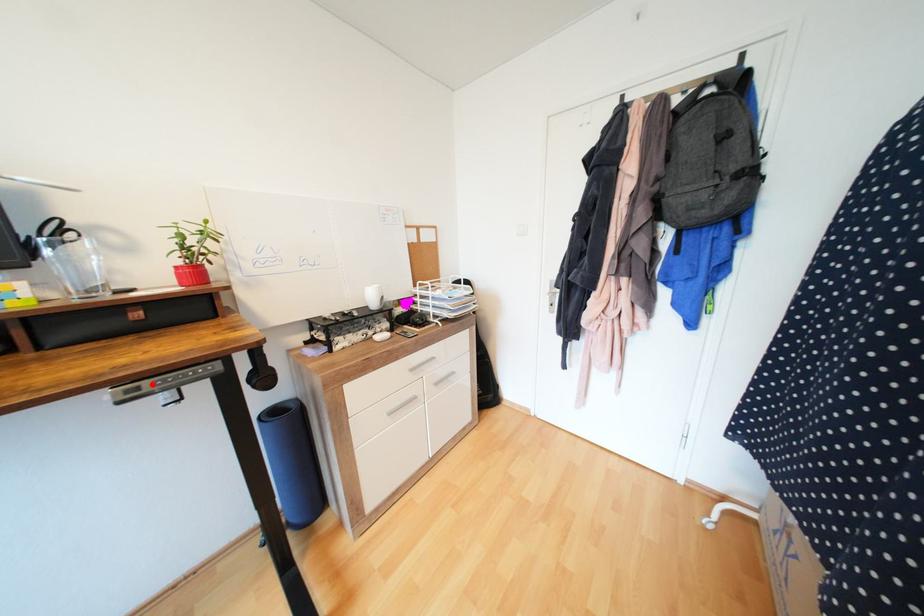
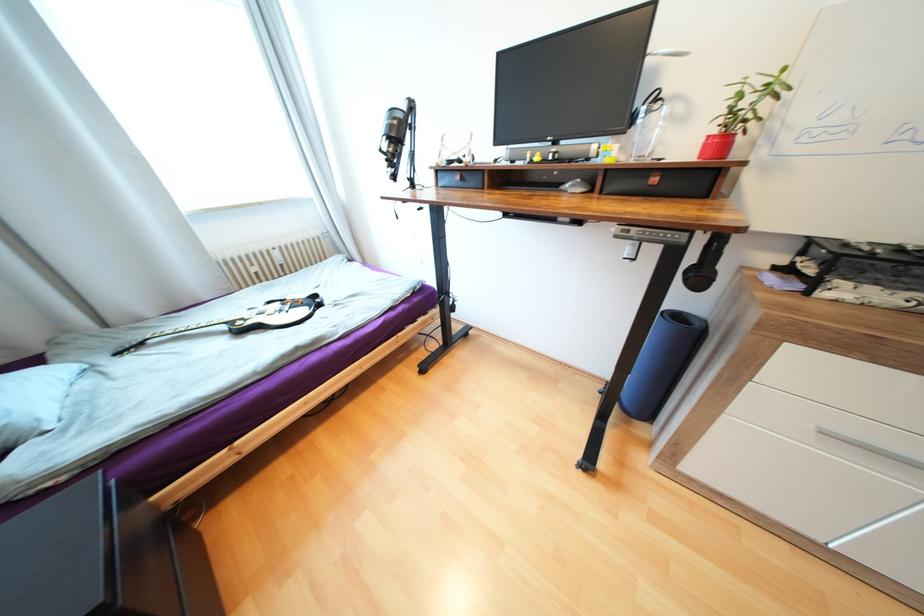
Question: I am providing you with two images of the same scene from different viewpoints. A red point is marked on the first image. Can you still see the location of the red point in image 2?

Choices:
 (A) Yes
 (B) No

Answer: (A)